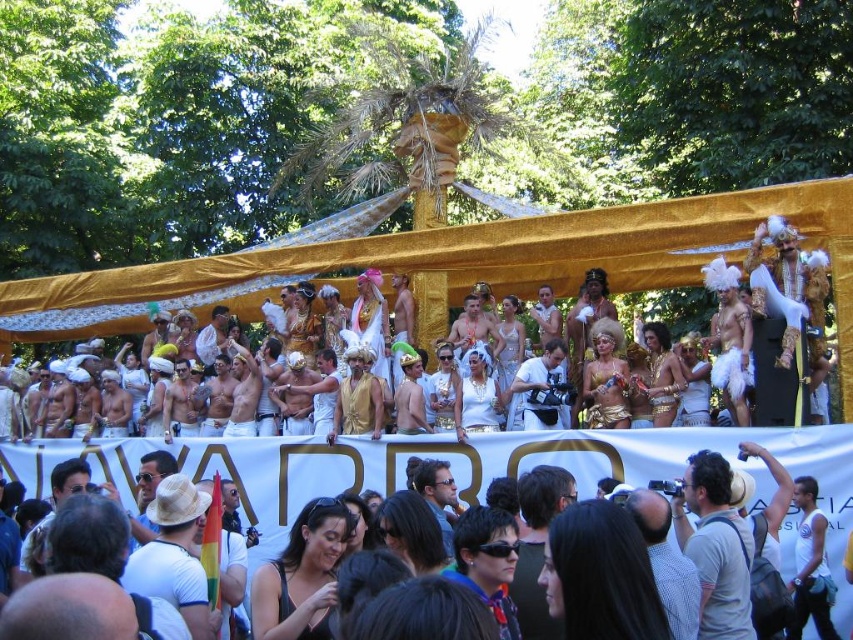
Question: Is plaid shirt at center smaller than gold metallic crown at center?

Choices:
 (A) yes
 (B) no

Answer: (A)

Question: Which point is farther from the camera taking this photo?

Choices:
 (A) (704, 458)
 (B) (299, 392)
 (C) (186, 509)
 (D) (628, 497)

Answer: (B)

Question: Which is nearer to the gold metallic helmet at center?

Choices:
 (A) white matte tank top at lower right
 (B) gold metallic crown at center
 (C) shiny gold vest at center
 (D) matte black sunglasses at center

Answer: (D)

Question: Which of the following is the closest to the observer?

Choices:
 (A) (744, 604)
 (B) (328, 432)

Answer: (A)

Question: Can you confirm if golden fabric turban at center is positioned below gold metallic crown at center?

Choices:
 (A) no
 (B) yes

Answer: (B)

Question: Does white straw hat at center have a smaller size compared to shiny gold vest at center?

Choices:
 (A) yes
 (B) no

Answer: (B)